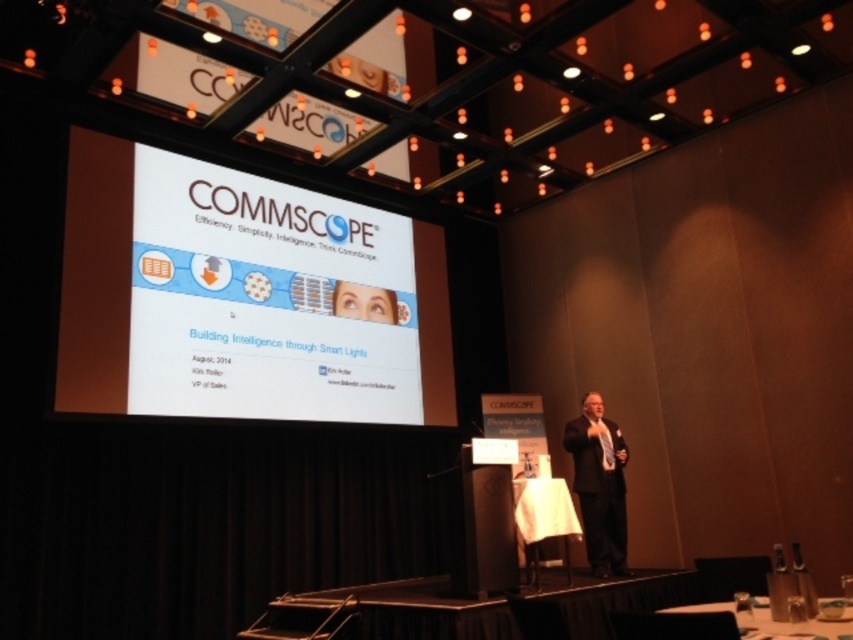
You are an event organizer who needs to set up a new banner that is 2 meters tall. The banner must be placed between the white glossy projection screen at upper center and the white cloth at center. Will the banner fit vertically between these two objects based on their heights?

The white glossy projection screen at upper center is taller than the white cloth at center. Since the banner is 2 meters tall, it can be placed between them vertically as long as the vertical space between the screen and cloth accommodates its height. However, the exact vertical clearance isn

You are an attendee sitting in the front row of the conference hall. You notice the black suit at center and the black plastic table at lower right. Which object is closer to your left side?

The black plastic table at lower right is closer to your left side because the black suit at center is to the right of it.